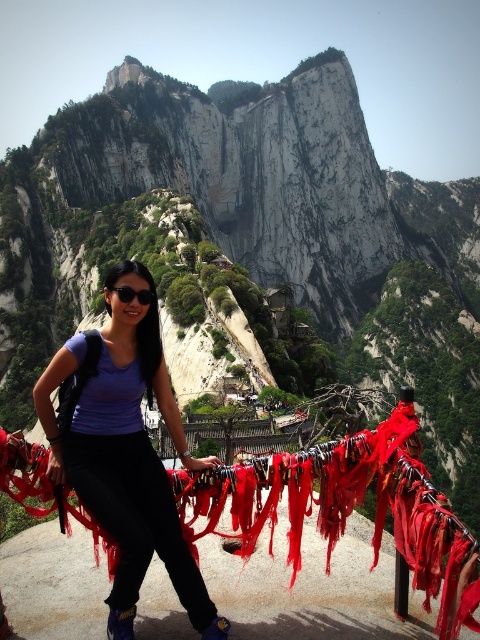
You are a photographer planning to capture a shot of the smooth white rock at center and the matte black sunglasses at center. Based on their positions, which object should you focus on first if you want to start with the one closer to the camera?

The smooth white rock at center is located above matte black sunglasses at center, meaning it is closer to the camera. Therefore, you should focus on the smooth white rock at center first.

You are a photographer planning to capture a photo of the smooth white rock at center and the matte black sunglasses at center in the scenic mountain view. Given that your camera has a maximum focus range of 130 meters, will both objects be in focus simultaneously?

The smooth white rock at center and matte black sunglasses at center are 136.52 meters apart, which exceeds the camera maximum focus range of 130 meters. Therefore, both objects cannot be in focus simultaneously.

You are a photographer planning to take a picture of the smooth white rock at center and the red fabric ribbon at center. Which object should you focus on first to ensure both are in the frame without moving the camera?

You should focus on the smooth white rock at center first because it is closer to you than the red fabric ribbon at center, so adjusting the focus to it will help capture both objects in the frame without moving the camera.